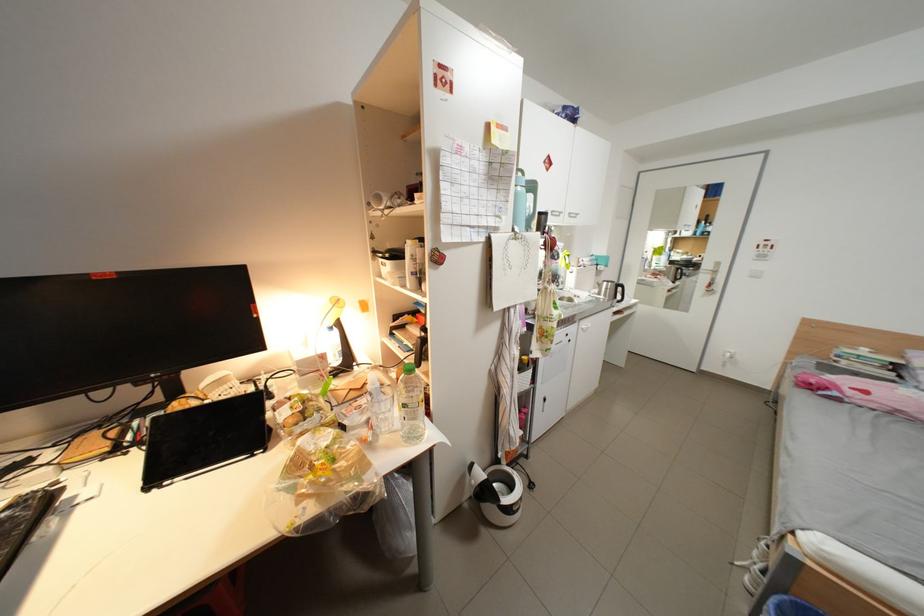
I want to click on silver cabinet handle, so click(x=584, y=325).